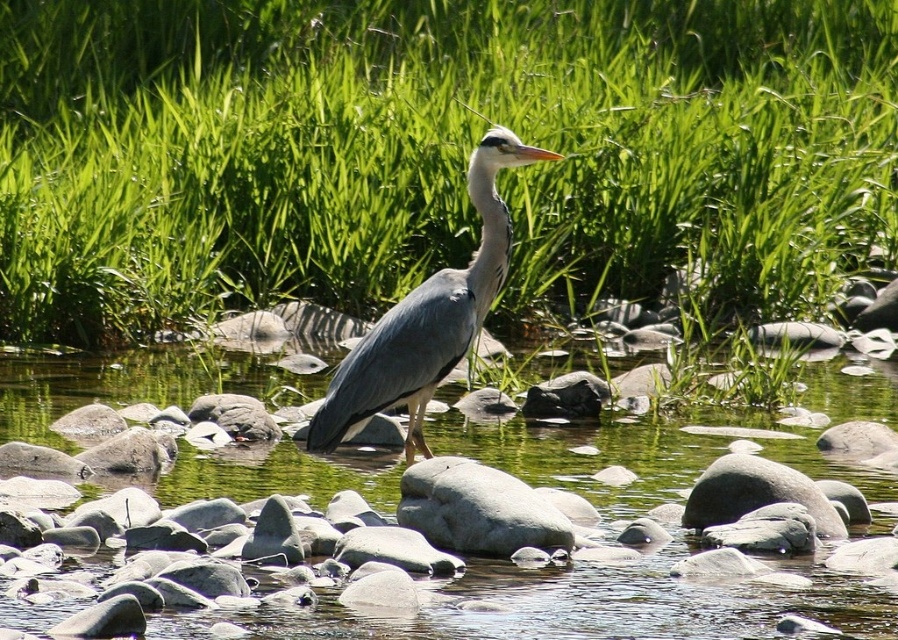
You are a photographer trying to capture the grey heron in the scene. The green smooth water at center is crucial for the reflection in your shot. Where exactly should you position your camera to ensure the reflection is centered in the frame?

The green smooth water at center is located at point (587, 604), so you should position your camera directly above or aligned with those coordinates to center the reflection in your shot.

In the scene shown: You are a photographer trying to capture the entire gray matte heron at center and the green grass at upper center in a single frame. Based on the scene, which object will occupy more horizontal space in the photo?

The green grass at upper center will occupy more horizontal space in the photo because its width surpasses that of the gray matte heron at center.